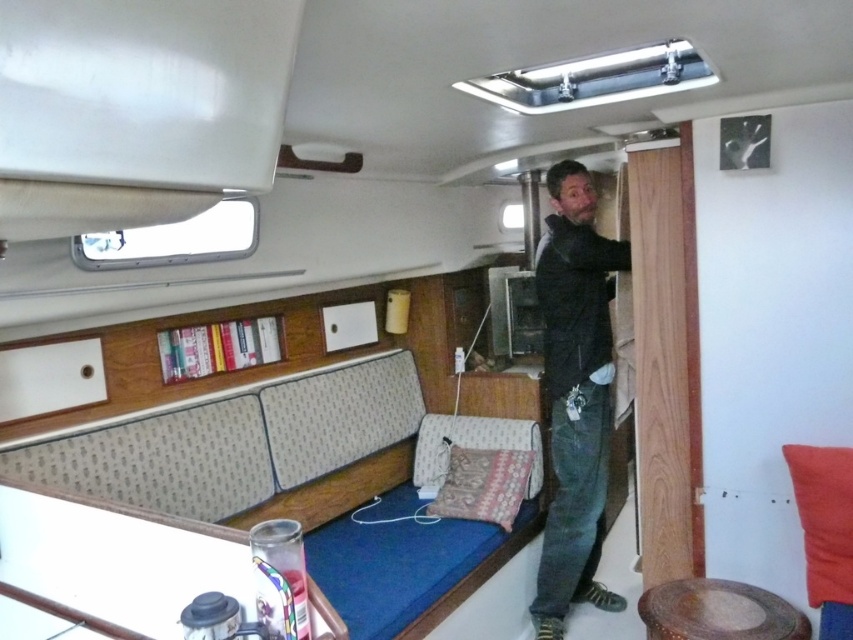
Between patterned fabric couch at lower left and wooden textured stool at lower right, which one has less height?

Standing shorter between the two is wooden textured stool at lower right.

Does patterned fabric couch at lower left lie in front of wooden textured stool at lower right?

No, it is not.

Does point (335, 589) lie behind point (656, 609)?

Yes, it is.

Locate an element on the screen. The image size is (853, 640). patterned fabric couch at lower left is located at coordinates (241, 442).

Measure the distance between point (277, 474) and camera.

2.77 meters

Between point (213, 483) and point (585, 232), which one is positioned in front?

Point (213, 483)

Between point (77, 454) and point (596, 509), which one is positioned in front?

Positioned in front is point (77, 454).

Where is `patterned fabric couch at lower left`? The height and width of the screenshot is (640, 853). patterned fabric couch at lower left is located at coordinates (241, 442).

Between dark gray leather jacket at center and patterned fabric pillow at lower center, which one is positioned higher?

Positioned higher is dark gray leather jacket at center.

Does point (567, 456) come in front of point (521, 486)?

Yes, it is in front of point (521, 486).

Locate an element on the screen. This screenshot has width=853, height=640. dark gray leather jacket at center is located at coordinates (575, 394).